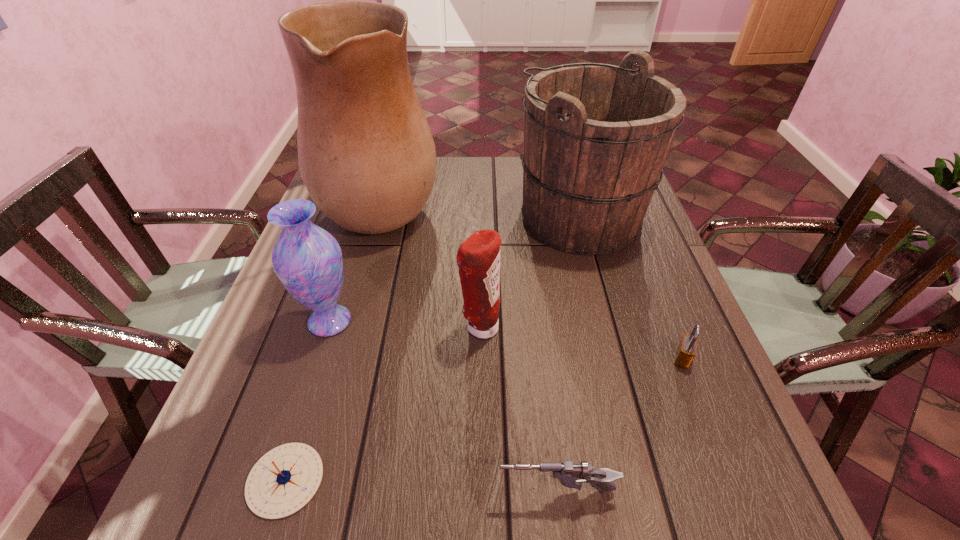
You are a GUI agent. You are given a task and a screenshot of the screen. Output one action in this format:
    pyautogui.click(x=<x>, y=<y>)
    Task: Click on the blank region between the condiment and the compass
    This screenshot has width=960, height=540.
    Given the screenshot: What is the action you would take?
    pyautogui.click(x=383, y=403)

Identify which object is the third closest to the gun. Please provide its 2D coordinates. Your answer should be formatted as a tuple, i.e. [(x, y)], where the tuple contains the x and y coordinates of a point satisfying the conditions above.

[(284, 480)]

Where is `the closest object to the cream pitcher`? Image resolution: width=960 pixels, height=540 pixels. the closest object to the cream pitcher is located at coordinates (307, 259).

This screenshot has width=960, height=540. In order to click on vacant space that satisfies the following two spatial constraints: 1. at the spout of the fourth shortest object; 2. on the left side of the cream pitcher in this screenshot , I will do `click(348, 327)`.

You are a GUI agent. You are given a task and a screenshot of the screen. Output one action in this format:
    pyautogui.click(x=<x>, y=<y>)
    Task: Click on the free space that satisfies the following two spatial constraints: 1. on the front side of the third tallest object; 2. on the left side of the padlock
    
    Given the screenshot: What is the action you would take?
    pyautogui.click(x=318, y=359)

This screenshot has height=540, width=960. I want to click on vacant area in the image that satisfies the following two spatial constraints: 1. at the spout of the condiment; 2. on the right side of the tallest object, so click(x=348, y=327).

Identify the location of free space in the image that satisfies the following two spatial constraints: 1. on the back side of the compass; 2. on the right side of the padlock. The height and width of the screenshot is (540, 960). (323, 359).